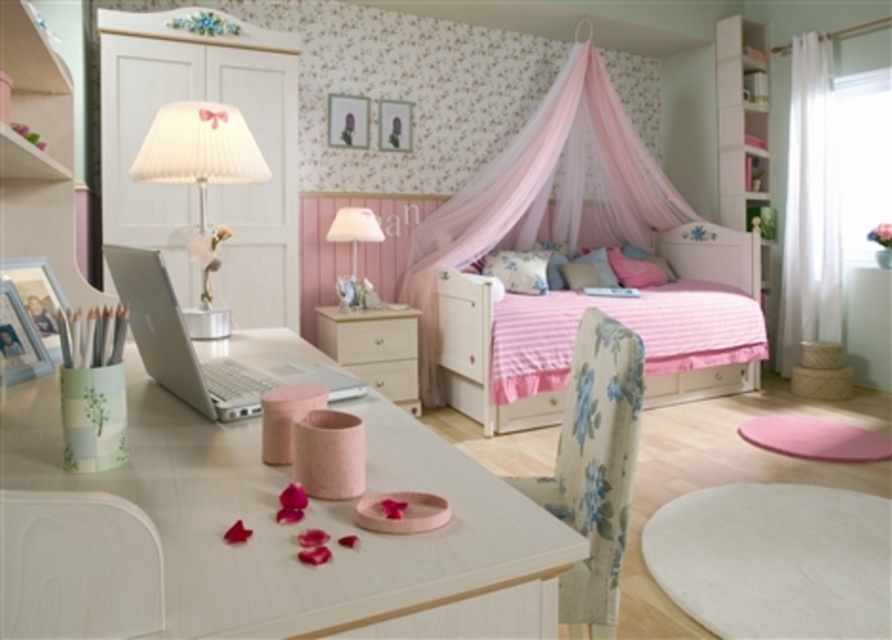
You are a delivery person who needs to place a package on the floor between the white glossy chair at lower left and the matte pink drawer at center. The package is 10 feet long. Will it fit in the space between them?

The distance between the white glossy chair at lower left and the matte pink drawer at center is 10.54 feet, so the 10 feet long package will fit in the space between them.

You are organizing your desk and want to place a new notebook between the silver metallic laptop at center and the white glossy drawer at center. Based on their positions, which object should the notebook be closer to?

The notebook should be placed closer to the white glossy drawer at center because the silver metallic laptop at center is in front of it, meaning the drawer is behind the laptop.

You are a visitor in this bedroom and want to sit down. You see the white glossy chair at lower left and the matte pink drawer at center. Which object is higher up from the floor?

The white glossy chair at lower left is located above the matte pink drawer at center, so it is higher up from the floor.